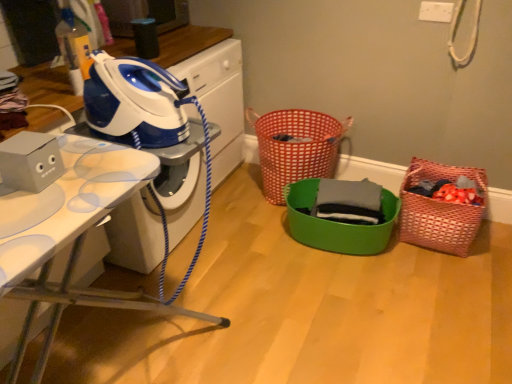
The image size is (512, 384). Find the location of `vacant space situated on the left part of green plastic basket at center, marked as the 2th basket in a left-to-right arrangement`. vacant space situated on the left part of green plastic basket at center, marked as the 2th basket in a left-to-right arrangement is located at coordinates (247, 254).